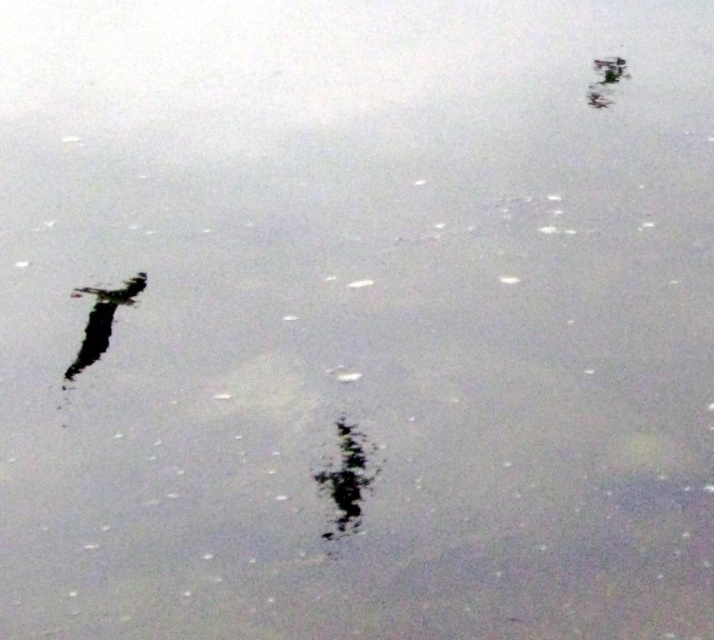
Question: Which object appears farthest from the camera in this image?

Choices:
 (A) black matte tree at center
 (B) silky black feather at left

Answer: (B)

Question: Which object appears closest to the camera in this image?

Choices:
 (A) black matte tree at center
 (B) silky black feather at left

Answer: (A)

Question: Can you confirm if black matte tree at center is smaller than silky black feather at left?

Choices:
 (A) no
 (B) yes

Answer: (B)

Question: Is black matte tree at center to the right of silky black feather at left from the viewer's perspective?

Choices:
 (A) no
 (B) yes

Answer: (B)

Question: Can you confirm if black matte tree at center is bigger than silky black feather at left?

Choices:
 (A) yes
 (B) no

Answer: (B)